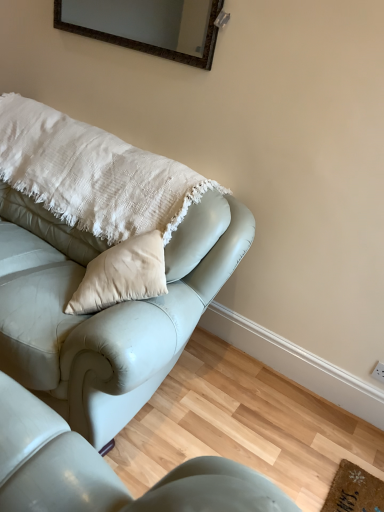
Question: Is matte leather couch at upper left, which appears as the first studio couch when viewed from the top, further to the viewer compared to leather couch at lower left, positioned as the 1th studio couch in bottom-to-top order?

Choices:
 (A) no
 (B) yes

Answer: (B)

Question: Does matte leather couch at upper left, which appears as the 2th studio couch when ordered from the bottom, appear on the left side of leather couch at lower left, marked as the 2th studio couch in a top-to-bottom arrangement?

Choices:
 (A) no
 (B) yes

Answer: (B)

Question: From the image's perspective, is matte leather couch at upper left, which appears as the 2th studio couch when ordered from the bottom, over leather couch at lower left, positioned as the 1th studio couch in bottom-to-top order?

Choices:
 (A) no
 (B) yes

Answer: (B)

Question: Are matte leather couch at upper left, which appears as the 2th studio couch when ordered from the bottom, and leather couch at lower left, positioned as the 1th studio couch in bottom-to-top order, far apart?

Choices:
 (A) yes
 (B) no

Answer: (B)

Question: Is matte leather couch at upper left, which appears as the first studio couch when viewed from the top, next to leather couch at lower left, marked as the 2th studio couch in a top-to-bottom arrangement?

Choices:
 (A) no
 (B) yes

Answer: (A)

Question: Considering their positions, is leather couch at lower left, marked as the 2th studio couch in a top-to-bottom arrangement, located in front of or behind matte brown frame at upper center?

Choices:
 (A) front
 (B) behind

Answer: (A)

Question: From the image's perspective, is leather couch at lower left, marked as the 2th studio couch in a top-to-bottom arrangement, located above or below matte brown frame at upper center?

Choices:
 (A) above
 (B) below

Answer: (B)

Question: In terms of width, does leather couch at lower left, marked as the 2th studio couch in a top-to-bottom arrangement, look wider or thinner when compared to matte brown frame at upper center?

Choices:
 (A) wide
 (B) thin

Answer: (A)

Question: From a real-world perspective, is leather couch at lower left, positioned as the 1th studio couch in bottom-to-top order, physically located above or below matte brown frame at upper center?

Choices:
 (A) below
 (B) above

Answer: (A)

Question: From the image's perspective, is white cotton pillow at upper left above or below matte leather couch at upper left, which appears as the first studio couch when viewed from the top?

Choices:
 (A) above
 (B) below

Answer: (A)

Question: Is point (13, 98) closer or farther from the camera than point (125, 343)?

Choices:
 (A) farther
 (B) closer

Answer: (A)

Question: Looking at the image, does white cotton pillow at upper left seem bigger or smaller compared to matte leather couch at upper left, which appears as the first studio couch when viewed from the top?

Choices:
 (A) small
 (B) big

Answer: (A)

Question: From a real-world perspective, relative to matte leather couch at upper left, which appears as the 2th studio couch when ordered from the bottom, is white cotton pillow at upper left vertically above or below?

Choices:
 (A) below
 (B) above

Answer: (B)

Question: Considering the positions of leather couch at lower left, marked as the 2th studio couch in a top-to-bottom arrangement, and white cotton pillow at upper left in the image, is leather couch at lower left, marked as the 2th studio couch in a top-to-bottom arrangement, taller or shorter than white cotton pillow at upper left?

Choices:
 (A) short
 (B) tall

Answer: (A)

Question: From a real-world perspective, is leather couch at lower left, positioned as the 1th studio couch in bottom-to-top order, physically located above or below white cotton pillow at upper left?

Choices:
 (A) above
 (B) below

Answer: (B)